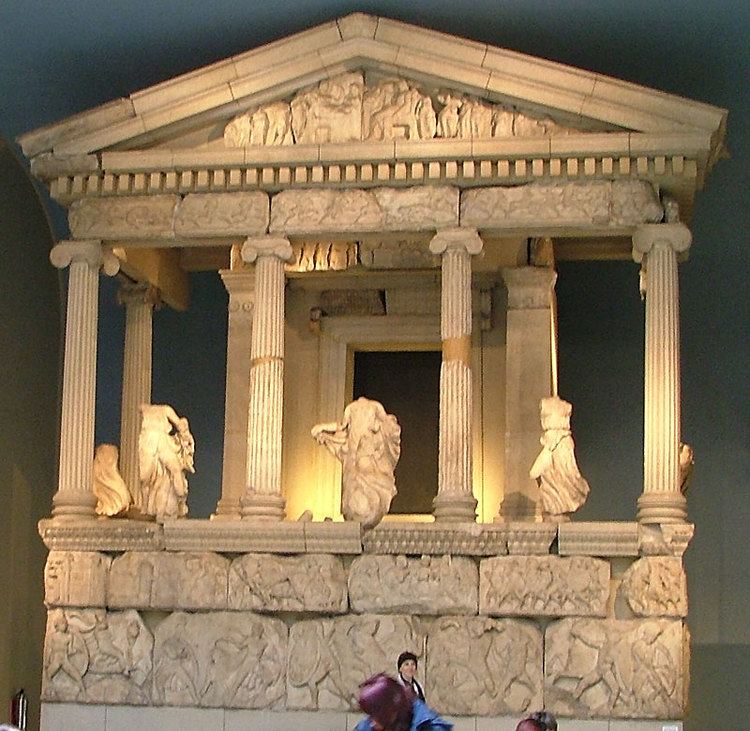
The height and width of the screenshot is (731, 750). What are the coordinates of `doorway` in the screenshot? It's located at (354, 393), (356, 354), (441, 352), (438, 424), (434, 493), (409, 510), (394, 473), (399, 430).